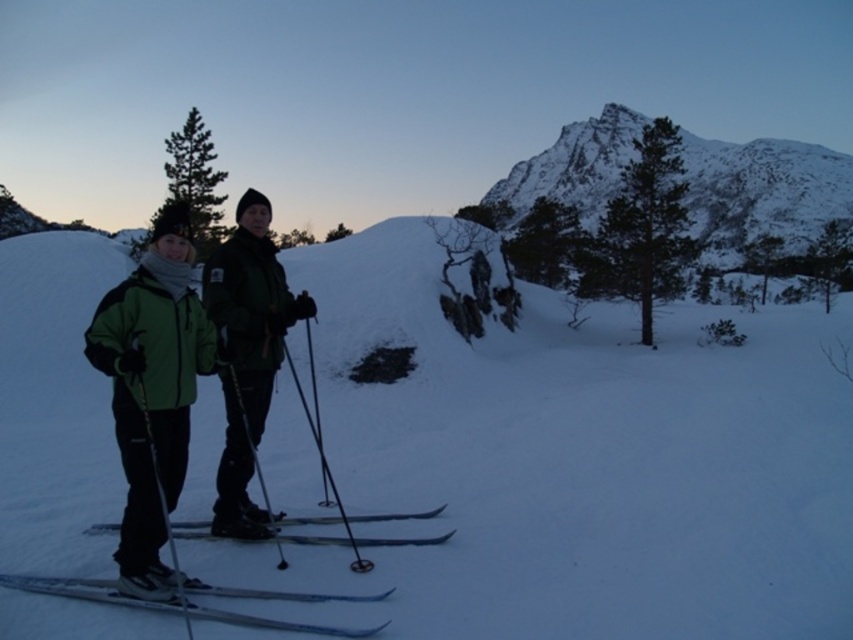
You are a photographer trying to capture the metallic ski pole at left and the black matte ski pole at center in a single frame. Which ski pole is located to the right of the other?

The metallic ski pole at left is positioned on the left side of black matte ski pole at center, so the black matte ski pole at center is to the right of the metallic ski pole at left.

You are a photographer trying to capture a clear shot of the green matte jacket at center and the black matte ski pole at center. Which object should you focus on first to ensure both are in focus?

The green matte jacket at center is positioned over the black matte ski pole at center, so focusing on the green matte jacket at center first will ensure both are in focus since it is closer to the camera.